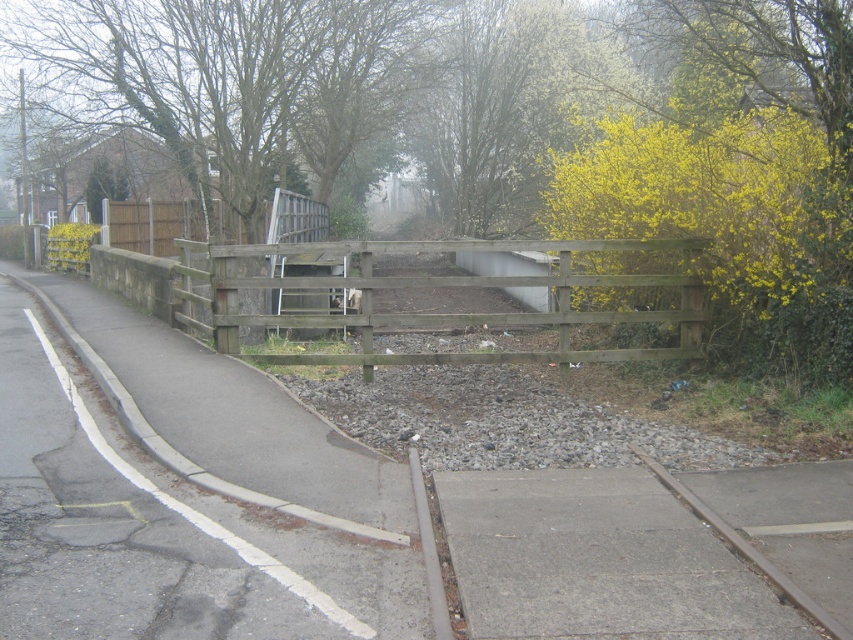
Is gray concrete pavement at center thinner than brown wooden fence at center?

Yes.

Does point (618, 472) lie behind point (224, 349)?

No.

What do you see at coordinates (596, 561) in the screenshot?
I see `gray concrete pavement at center` at bounding box center [596, 561].

You are a GUI agent. You are given a task and a screenshot of the screen. Output one action in this format:
    pyautogui.click(x=<x>, y=<y>)
    Task: Click on the gray concrete pavement at center
    
    Given the screenshot: What is the action you would take?
    pyautogui.click(x=596, y=561)

Can you confirm if gray concrete pavement at center is thinner than brown wooden train track at lower right?

No, gray concrete pavement at center is not thinner than brown wooden train track at lower right.

Between gray concrete pavement at center and brown wooden train track at lower right, which one appears on the right side from the viewer's perspective?

brown wooden train track at lower right

Is point (692, 552) closer to viewer compared to point (845, 632)?

No, (692, 552) is further to viewer.

Find the location of `gray concrete pavement at center`. gray concrete pavement at center is located at coordinates (596, 561).

Is brown wooden fence at center shorter than brown wooden train track at lower right?

No.

Is brown wooden fence at center bigger than brown wooden train track at lower right?

Indeed, brown wooden fence at center has a larger size compared to brown wooden train track at lower right.

Find the location of a particular element. The height and width of the screenshot is (640, 853). brown wooden fence at center is located at coordinates (408, 312).